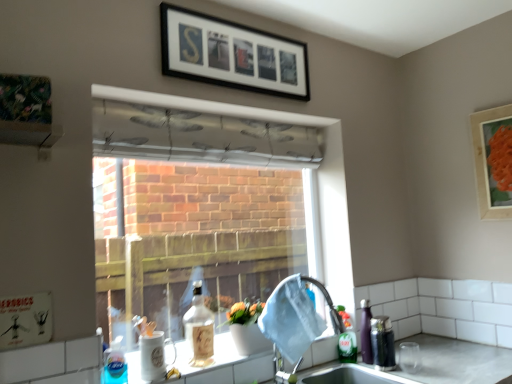
Question: From the image's perspective, is matte wooden picture frame at upper right, which is counted as the second picture frame, starting from the left, positioned above or below white ceramic mug at lower center?

Choices:
 (A) below
 (B) above

Answer: (B)

Question: Considering their positions, is matte wooden picture frame at upper right, which is counted as the first picture frame, starting from the bottom, located in front of or behind white ceramic mug at lower center?

Choices:
 (A) front
 (B) behind

Answer: (B)

Question: Estimate the real-world distances between objects in this image. Which object is closer to the translucent glass bottle at lower center, placed as the second bottle when sorted from back to front?

Choices:
 (A) green matte bottle at sink right, placed as the first bottle when sorted from back to front
 (B) black matte picture frame at upper center, positioned as the 1th picture frame in top-to-bottom order
 (C) matte wooden picture frame at upper right, which is counted as the first picture frame, starting from the bottom
 (D) transparent fabric at center
 (E) white ceramic mug at lower center

Answer: (A)

Question: Which is nearer to the translucent plastic bottle at lower left, placed as the first bottle when sorted from front to back?

Choices:
 (A) translucent plastic bottle at lower right, placed as the first beverage when sorted from right to left
 (B) matte wooden picture frame at upper right, acting as the 2th picture frame starting from the top
 (C) green matte bottle at sink right, placed as the first bottle when sorted from back to front
 (D) transparent fabric at center
 (E) satin nickel faucet at sink right

Answer: (E)